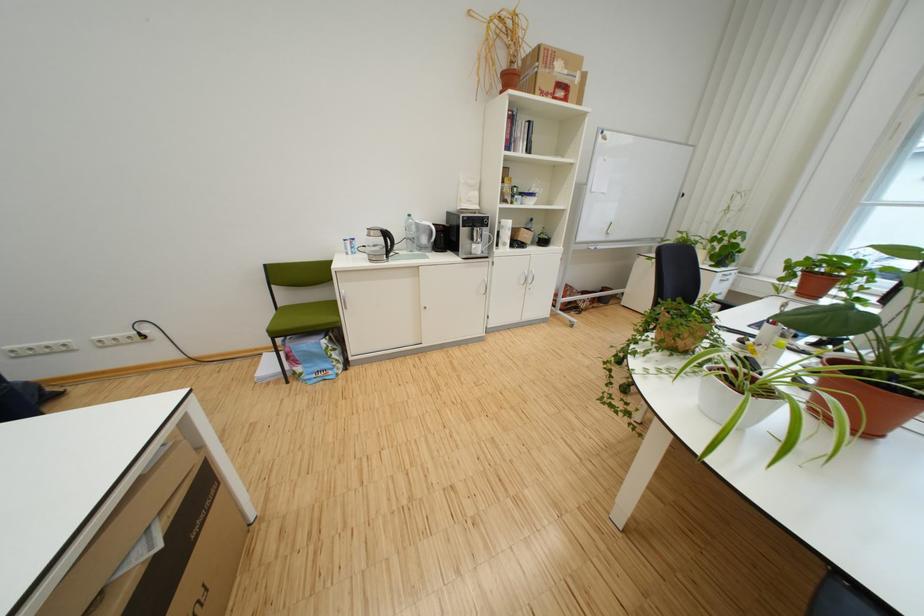
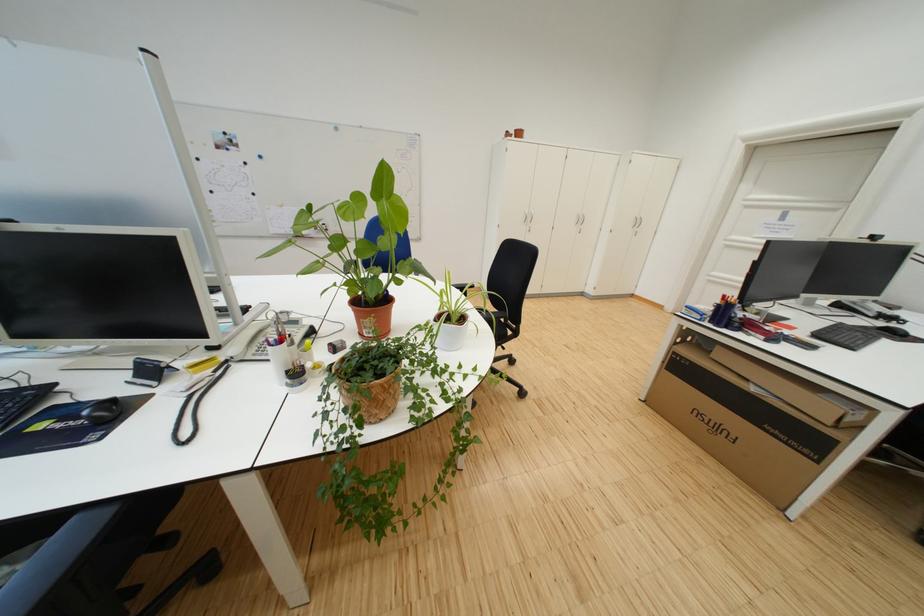
Question: I am providing you with two images of the same scene from different viewpoints. After the viewpoint changes to image2, which objects are now occluded?

Choices:
 (A) white boot
 (B) wicker plant pot
 (C) large cardboard box
 (D) terracotta flower pot

Answer: (D)